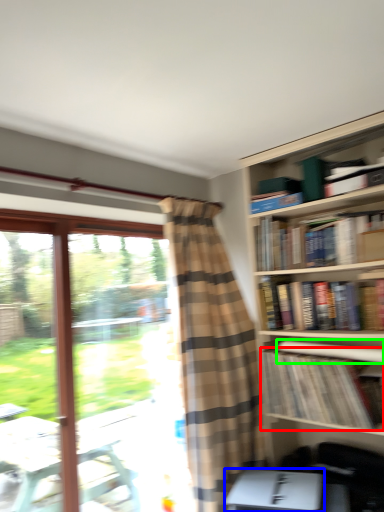
Question: Considering the real-world distances, which object is farthest from book (highlighted by a red box)? paperback book (highlighted by a blue box) or book (highlighted by a green box)?

Choices:
 (A) paperback book
 (B) book

Answer: (A)